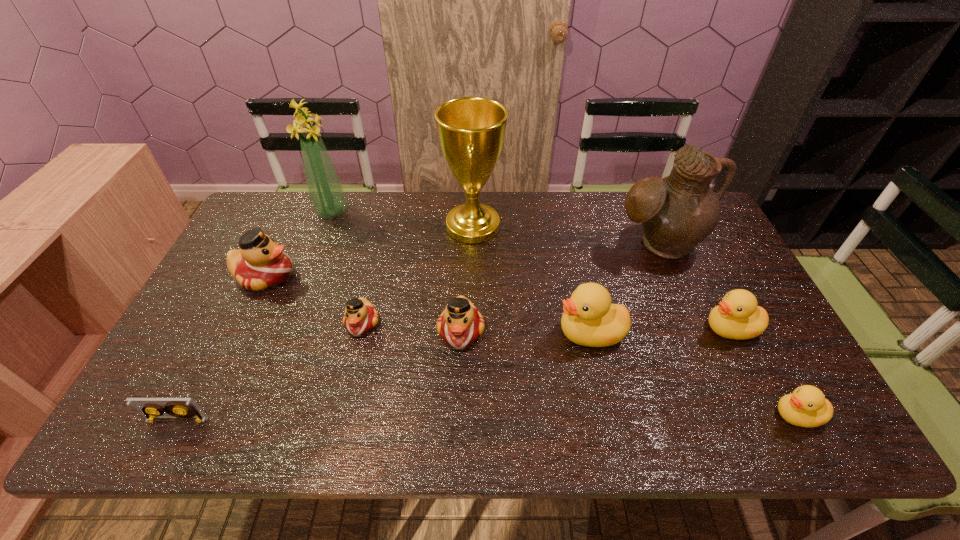
Locate an element on the screen. The image size is (960, 540). vacant area located at the beak of the nearest yellow duck is located at coordinates (724, 415).

You are a GUI agent. You are given a task and a screenshot of the screen. Output one action in this format:
    pyautogui.click(x=<x>, y=<y>)
    Task: Click on the free region located 0.370m at the beak of the nearest yellow duck
    Image resolution: width=960 pixels, height=540 pixels.
    Given the screenshot: What is the action you would take?
    pyautogui.click(x=608, y=415)

Find the location of a particular element. The height and width of the screenshot is (540, 960). bouquet located in the far edge section of the desktop is located at coordinates (326, 194).

At what (x,y) coordinates should I click in order to perform the action: click on award at the far edge. Please return your answer as a coordinate pair (x, y). Image resolution: width=960 pixels, height=540 pixels. Looking at the image, I should click on (471, 130).

The width and height of the screenshot is (960, 540). In order to click on pitcher that is positioned at the far edge in this screenshot , I will do `click(677, 212)`.

Locate an element on the screen. The height and width of the screenshot is (540, 960). duck that is positioned at the near edge is located at coordinates (807, 406).

At what (x,y) coordinates should I click in order to perform the action: click on videotape located in the near edge section of the desktop. Please return your answer as a coordinate pair (x, y). This screenshot has width=960, height=540. Looking at the image, I should click on (176, 409).

This screenshot has width=960, height=540. What are the coordinates of `duck that is at the left edge` in the screenshot? It's located at (260, 264).

Identify the location of videotape that is at the left edge. The width and height of the screenshot is (960, 540). (176, 409).

Find the location of a particular element. pitcher present at the right edge is located at coordinates (677, 212).